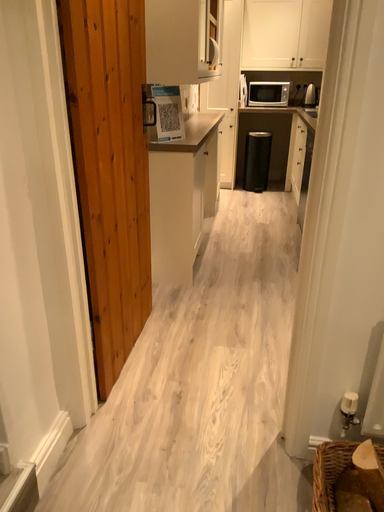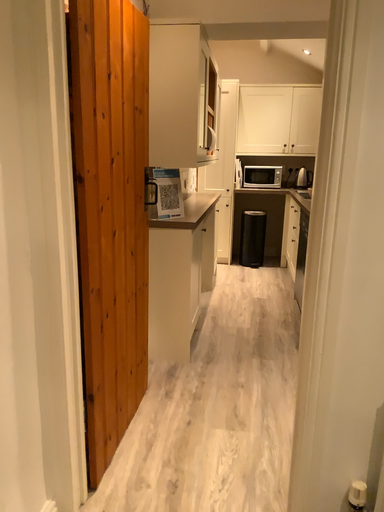
Question: How did the camera likely rotate when shooting the video?

Choices:
 (A) rotated downward
 (B) rotated upward

Answer: (B)